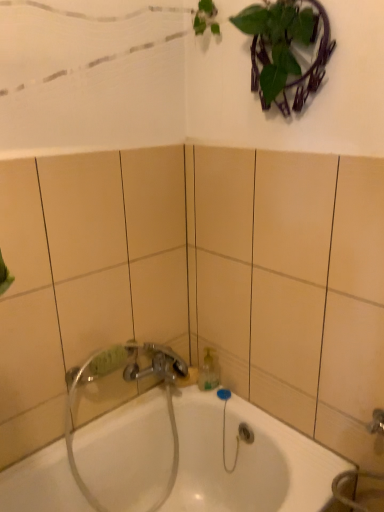
This screenshot has width=384, height=512. What do you see at coordinates (130, 381) in the screenshot?
I see `clear plastic hose at lower center` at bounding box center [130, 381].

What is the approximate width of clear plastic hose at lower center?

7.01 inches.

Where is `clear plastic hose at lower center`? clear plastic hose at lower center is located at coordinates (130, 381).

This screenshot has width=384, height=512. What do you see at coordinates (176, 461) in the screenshot?
I see `white glossy bathtub at center` at bounding box center [176, 461].

The width and height of the screenshot is (384, 512). Find the location of `white glossy bathtub at center`. white glossy bathtub at center is located at coordinates (176, 461).

In order to face white glossy bathtub at center, should I rotate leftwards or rightwards?

To face it directly, rotate left by 2.159 degrees.

Where is `clear plastic hose at lower center`? Image resolution: width=384 pixels, height=512 pixels. clear plastic hose at lower center is located at coordinates (130, 381).

Consider the image. Is white glossy bathtub at center at the left side of clear plastic hose at lower center?

No.

Is white glossy bathtub at center closer to camera compared to clear plastic hose at lower center?

Yes.

Is point (172, 469) closer to camera compared to point (69, 419)?

No.

From the image's perspective, is white glossy bathtub at center above or below clear plastic hose at lower center?

Based on their image positions, white glossy bathtub at center is located beneath clear plastic hose at lower center.

From a real-world perspective, is white glossy bathtub at center beneath clear plastic hose at lower center?

Yes, from a real-world perspective, white glossy bathtub at center is under clear plastic hose at lower center.

Considering the relative sizes of white glossy bathtub at center and clear plastic hose at lower center in the image provided, is white glossy bathtub at center thinner than clear plastic hose at lower center?

No, white glossy bathtub at center is not thinner than clear plastic hose at lower center.

Considering the sizes of objects white glossy bathtub at center and clear plastic hose at lower center in the image provided, who is taller, white glossy bathtub at center or clear plastic hose at lower center?

Result: Standing taller between the two is clear plastic hose at lower center.

Looking at this image, considering the sizes of white glossy bathtub at center and clear plastic hose at lower center in the image, is white glossy bathtub at center bigger or smaller than clear plastic hose at lower center?

In the image, white glossy bathtub at center appears to be larger than clear plastic hose at lower center.

Is white glossy bathtub at center located outside clear plastic hose at lower center?

Absolutely, white glossy bathtub at center is external to clear plastic hose at lower center.

Can you see white glossy bathtub at center touching clear plastic hose at lower center?

white glossy bathtub at center is not next to clear plastic hose at lower center, and they're not touching.

Based on the photo, is white glossy bathtub at center looking in the opposite direction of clear plastic hose at lower center?

Yes, white glossy bathtub at center's orientation is away from clear plastic hose at lower center.

How different are the orientations of white glossy bathtub at center and clear plastic hose at lower center in degrees?

The facing directions of white glossy bathtub at center and clear plastic hose at lower center are 0.00173 degrees apart.

Identify the location of bathtub that appears below the clear plastic hose at lower center (from the image's perspective). This screenshot has height=512, width=384. (176, 461).

Does clear plastic hose at lower center appear on the left side of white glossy bathtub at center?

Correct, you'll find clear plastic hose at lower center to the left of white glossy bathtub at center.

Is clear plastic hose at lower center in front of or behind white glossy bathtub at center in the image?

Visually, clear plastic hose at lower center is located behind white glossy bathtub at center.

Does point (101, 509) come farther from viewer compared to point (347, 462)?

Yes, point (101, 509) is farther from viewer.

Based on the photo, from the image's perspective, is clear plastic hose at lower center over white glossy bathtub at center?

Yes.

From a real-world perspective, is clear plastic hose at lower center physically below white glossy bathtub at center?

Actually, clear plastic hose at lower center is physically above white glossy bathtub at center in the real world.

Which of these two, clear plastic hose at lower center or white glossy bathtub at center, is thinner?

With smaller width is clear plastic hose at lower center.

In terms of height, does clear plastic hose at lower center look taller or shorter compared to white glossy bathtub at center?

Clearly, clear plastic hose at lower center is taller compared to white glossy bathtub at center.

Does clear plastic hose at lower center have a smaller size compared to white glossy bathtub at center?

Correct, clear plastic hose at lower center occupies less space than white glossy bathtub at center.

Do you think clear plastic hose at lower center is within white glossy bathtub at center, or outside of it?

clear plastic hose at lower center is located inside white glossy bathtub at center.

Is there a large distance between clear plastic hose at lower center and white glossy bathtub at center?

No.

Is clear plastic hose at lower center aimed at white glossy bathtub at center?

Yes, clear plastic hose at lower center is facing white glossy bathtub at center.

Consider the image. Measure the distance from clear plastic hose at lower center to white glossy bathtub at center.

clear plastic hose at lower center and white glossy bathtub at center are 5.61 inches apart.

Image resolution: width=384 pixels, height=512 pixels. In order to click on bathtub below the clear plastic hose at lower center (from the image's perspective) in this screenshot , I will do `click(176, 461)`.

In order to click on plumbing fixture above the white glossy bathtub at center (from a real-world perspective) in this screenshot , I will do `click(130, 381)`.

Find the location of a particular element. The height and width of the screenshot is (512, 384). bathtub that appears below the clear plastic hose at lower center (from the image's perspective) is located at coordinates (176, 461).